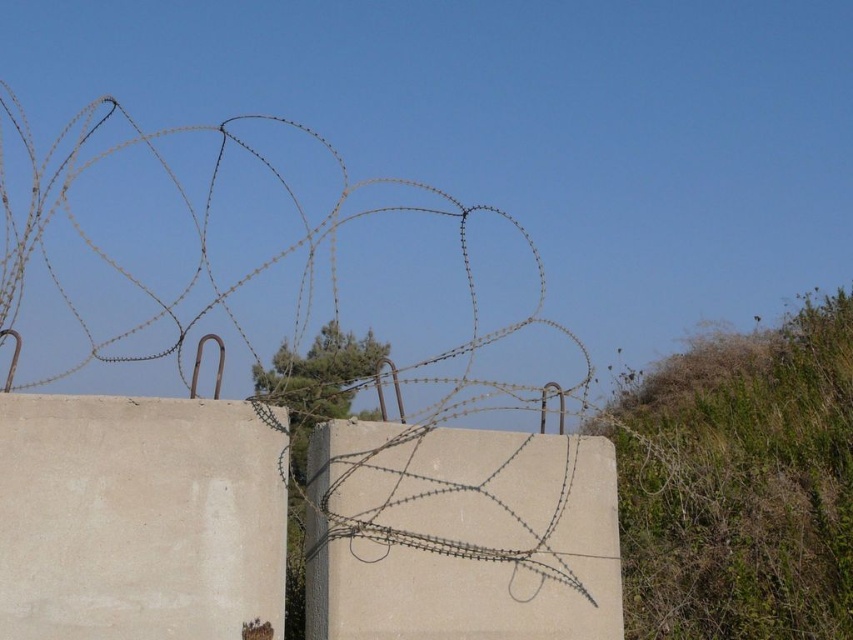
You are a maintenance worker assessing the barrier. You notice the beige concrete at center and the brown wire at upper center. Which object has a narrower width?

The beige concrete at center has a lesser width compared to the brown wire at upper center, so the beige concrete at center is narrower.

You are standing at the camera position looking at the concrete barrier with barbed wire. There is a point marked at coordinates [409,570] on the barrier. If you want to touch that point with a stick that is 15 feet long, will the stick be long enough?

The point at [409,570] is 17.43 feet away from the camera. Since the stick is only 15 feet long, it won

You are a construction worker assessing a concrete barrier with barbed wire. You notice two sections of concrete at the center, beige concrete at center and gray concrete at center. Which section is narrower in width?

The beige concrete at center has a lesser width compared to gray concrete at center, so the beige concrete at center is narrower.